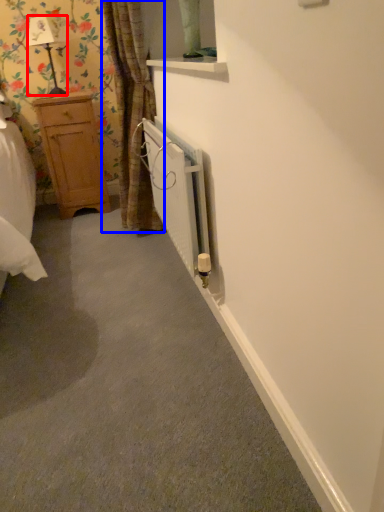
Question: Which object appears farthest to the camera in this image, lamp (highlighted by a red box) or curtain (highlighted by a blue box)?

Choices:
 (A) lamp
 (B) curtain

Answer: (A)